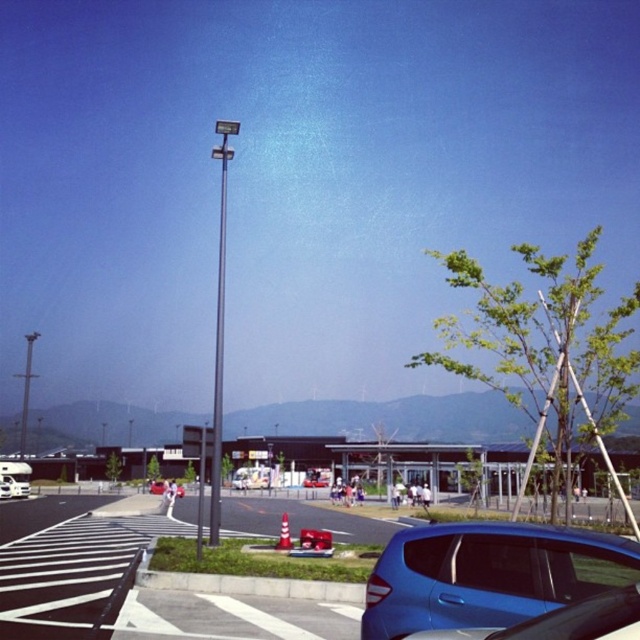
Question: Among these points, which one is farthest from the camera?

Choices:
 (A) (218, 349)
 (B) (326, 481)
 (C) (557, 531)

Answer: (B)

Question: Can you confirm if glossy blue hatchback at lower right is bigger than blue glossy car at lower right?

Choices:
 (A) no
 (B) yes

Answer: (A)

Question: Is glossy blue hatchback at lower right smaller than black metallic pole at center?

Choices:
 (A) no
 (B) yes

Answer: (B)

Question: Which object is closer to the camera taking this photo?

Choices:
 (A) blue glossy car at lower right
 (B) metallic silver van at center
 (C) black metallic pole at center
 (D) white glossy camper van at lower left

Answer: (A)

Question: Considering the relative positions of blue glossy car at lower right and metallic silver car at center in the image provided, where is blue glossy car at lower right located with respect to metallic silver car at center?

Choices:
 (A) left
 (B) right

Answer: (A)

Question: Which object appears closest to the camera in this image?

Choices:
 (A) metallic silver car at center
 (B) glossy blue hatchback at lower right
 (C) white glossy camper van at lower left

Answer: (B)